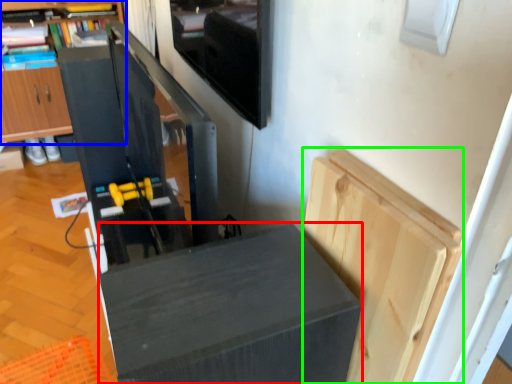
Question: Estimate the real-world distances between objects in this image. Which object is closer to furniture (highlighted by a red box), cabinetry (highlighted by a blue box) or cabinetry (highlighted by a green box)?

Choices:
 (A) cabinetry
 (B) cabinetry

Answer: (B)